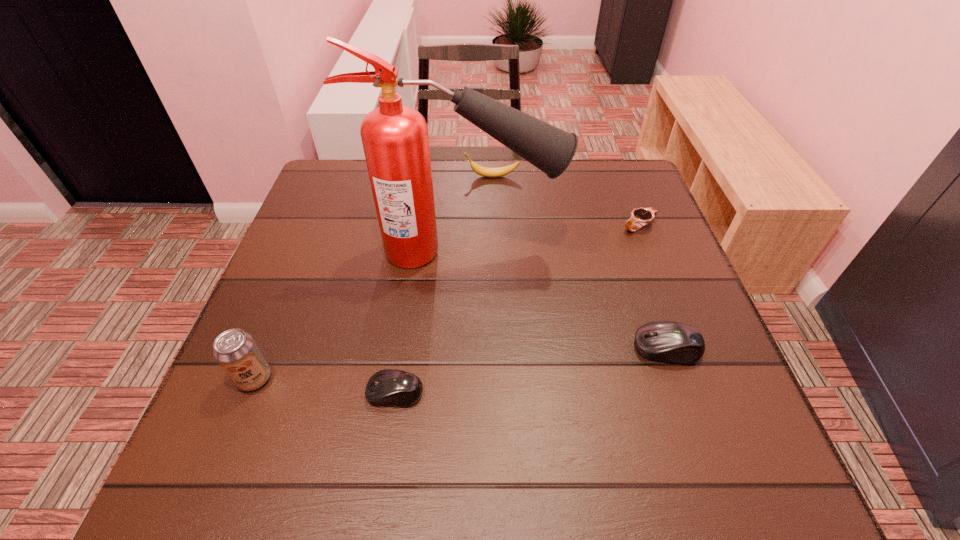
The image size is (960, 540). Find the location of `vacant area that lies between the shorter mouse and the shortest object`. vacant area that lies between the shorter mouse and the shortest object is located at coordinates (517, 309).

Locate which object ranks fourth in proximity to the taller mouse. Please provide its 2D coordinates. Your answer should be formatted as a tuple, i.e. [(x, y)], where the tuple contains the x and y coordinates of a point satisfying the conditions above.

[(480, 170)]

The image size is (960, 540). I want to click on the second closest object relative to the right mouse, so click(641, 216).

Locate an element on the screen. vacant space that satisfies the following two spatial constraints: 1. on the back side of the beer can; 2. on the right side of the third shortest object is located at coordinates [x=266, y=348].

What are the coordinates of `vacant position in the image that satisfies the following two spatial constraints: 1. at the stem of the farthest object; 2. on the front side of the fifth shortest object` in the screenshot? It's located at (497, 378).

Find the location of a particular element. vacant position in the image that satisfies the following two spatial constraints: 1. at the stem of the farthest object; 2. on the back side of the right mouse is located at coordinates (496, 348).